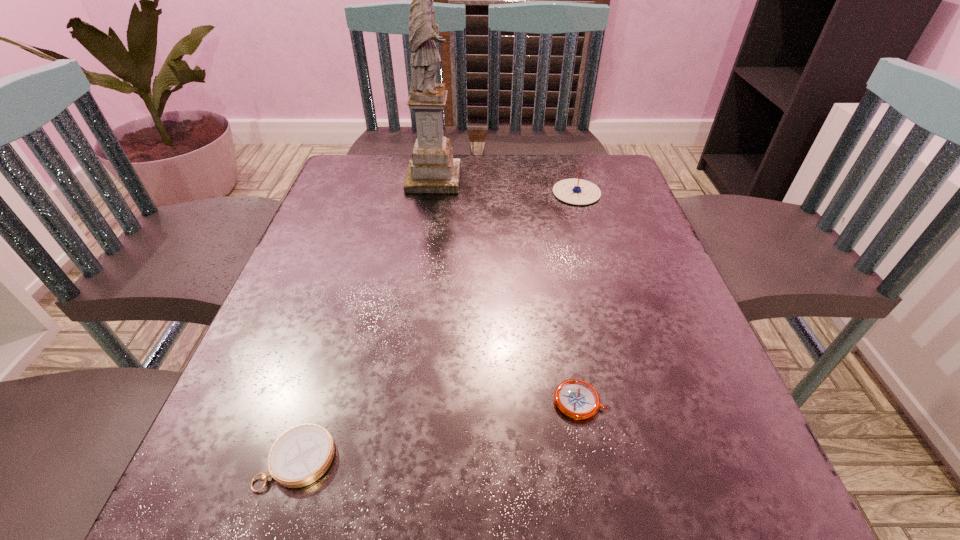
I want to click on vacant area situated on the back of the nearest compass, so point(354,273).

Find the location of a particular element. free space located on the left of the shortest compass is located at coordinates (515, 401).

Identify the location of sculpture that is at the far edge. Image resolution: width=960 pixels, height=540 pixels. (432, 169).

You are a GUI agent. You are given a task and a screenshot of the screen. Output one action in this format:
    pyautogui.click(x=<x>, y=<y>)
    Task: Click on the compass situated at the far edge
    The image size is (960, 540).
    Given the screenshot: What is the action you would take?
    pyautogui.click(x=573, y=191)

This screenshot has height=540, width=960. Find the location of `object present at the near edge`. object present at the near edge is located at coordinates (301, 455).

I want to click on object present at the left edge, so click(301, 455).

I want to click on object that is at the right edge, so click(x=573, y=191).

You are a GUI agent. You are given a task and a screenshot of the screen. Output one action in this format:
    pyautogui.click(x=<x>, y=<y>)
    Task: Click on the object that is at the near left corner
    
    Given the screenshot: What is the action you would take?
    pyautogui.click(x=301, y=455)

Where is `object that is at the far right corner`? The image size is (960, 540). object that is at the far right corner is located at coordinates (573, 191).

Where is `vacant space at the far edge of the desktop`? Image resolution: width=960 pixels, height=540 pixels. vacant space at the far edge of the desktop is located at coordinates (471, 184).